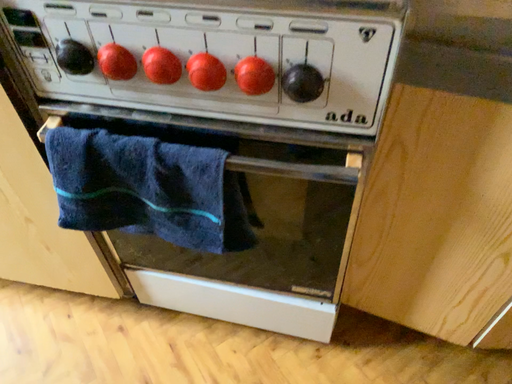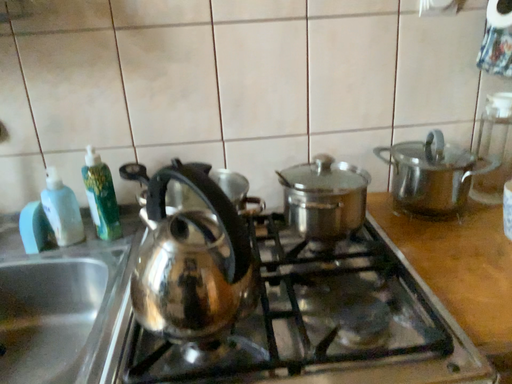
Question: Which way did the camera rotate in the video?

Choices:
 (A) rotated upward
 (B) rotated downward

Answer: (A)